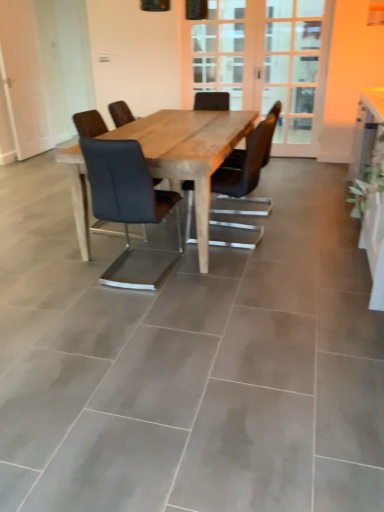
Where is `blank space to the left of matte black chair at center, the second chair in the right-to-left sequence`? The image size is (384, 512). blank space to the left of matte black chair at center, the second chair in the right-to-left sequence is located at coordinates click(70, 270).